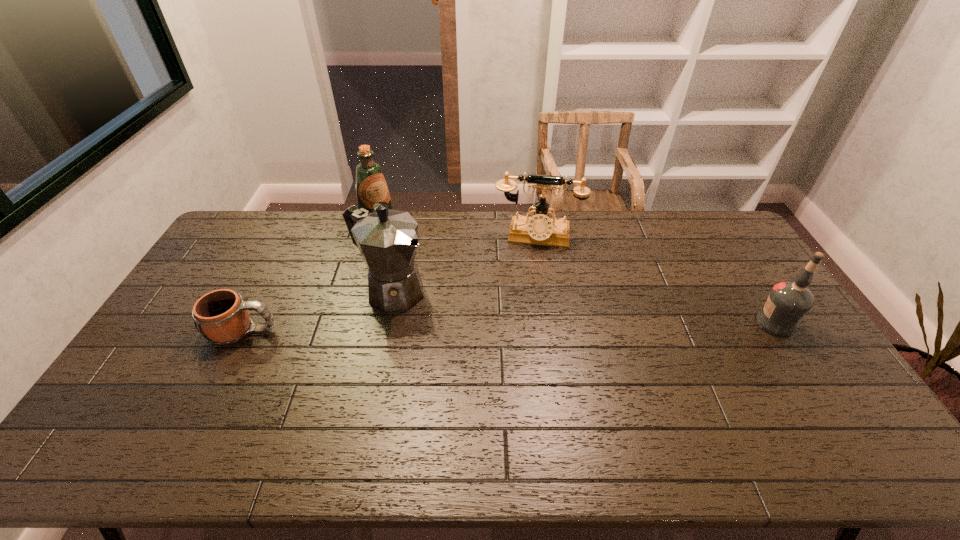
Identify the location of free spot on the desktop that is between the shortest object and the rightmost object and is positioned on the front-facing side of the olive oil. (482, 328).

Identify the location of free space on the desktop that is between the leftmost object and the vodka and is positioned on the dial of the second object from right to left. The height and width of the screenshot is (540, 960). (529, 327).

Locate an element on the screen. The image size is (960, 540). free space on the desktop that is between the mug and the vodka and is positioned on the pouring side of the coffeepot is located at coordinates (454, 328).